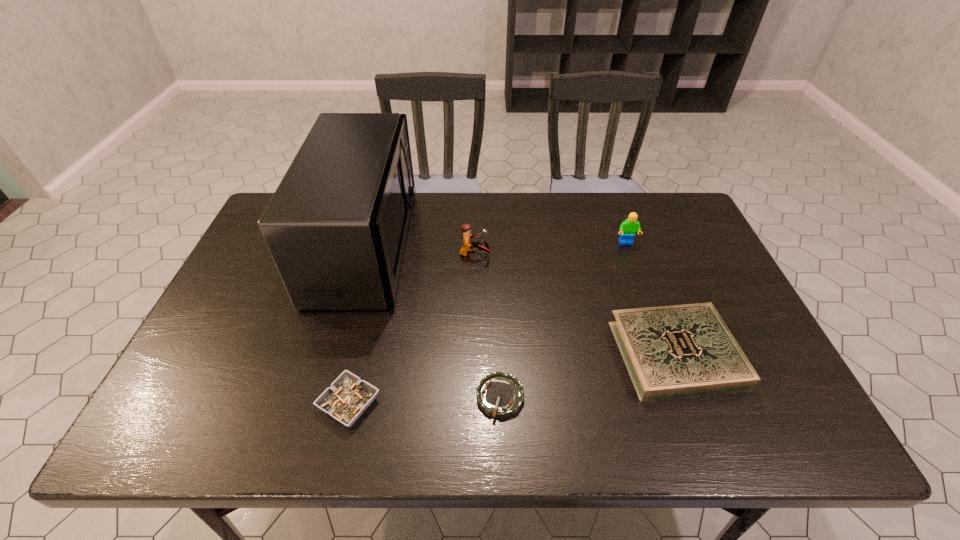
Locate an element on the screen. free space located holding a crossbow in the hands of the left Lego is located at coordinates (527, 254).

In order to click on vacant point located on the back of the hardback book in this screenshot , I will do `click(647, 279)`.

You are a GUI agent. You are given a task and a screenshot of the screen. Output one action in this format:
    pyautogui.click(x=<x>, y=<y>)
    Task: Click on the free space located on the left of the left ashtray
    This screenshot has width=960, height=540.
    Given the screenshot: What is the action you would take?
    pyautogui.click(x=208, y=403)

The width and height of the screenshot is (960, 540). Identify the location of vacant space situated 0.170m on the right of the shortest object. (601, 397).

Find the location of `object that is positioned at the far edge`. object that is positioned at the far edge is located at coordinates (336, 226).

Locate an element on the screen. Image resolution: width=960 pixels, height=540 pixels. object positioned at the right edge is located at coordinates (678, 351).

At what (x,y) coordinates should I click in order to perform the action: click on vacant space at the far edge of the desktop. Please return your answer as a coordinate pair (x, y). Looking at the image, I should click on (548, 220).

At what (x,y) coordinates should I click in order to perform the action: click on free space at the near edge of the desktop. Please return your answer as a coordinate pair (x, y). Image resolution: width=960 pixels, height=540 pixels. Looking at the image, I should click on (656, 418).

This screenshot has height=540, width=960. I want to click on vacant region at the left edge of the desktop, so click(x=254, y=317).

In the image, there is a desktop. Where is `vacant space at the right edge`? This screenshot has height=540, width=960. vacant space at the right edge is located at coordinates (785, 406).